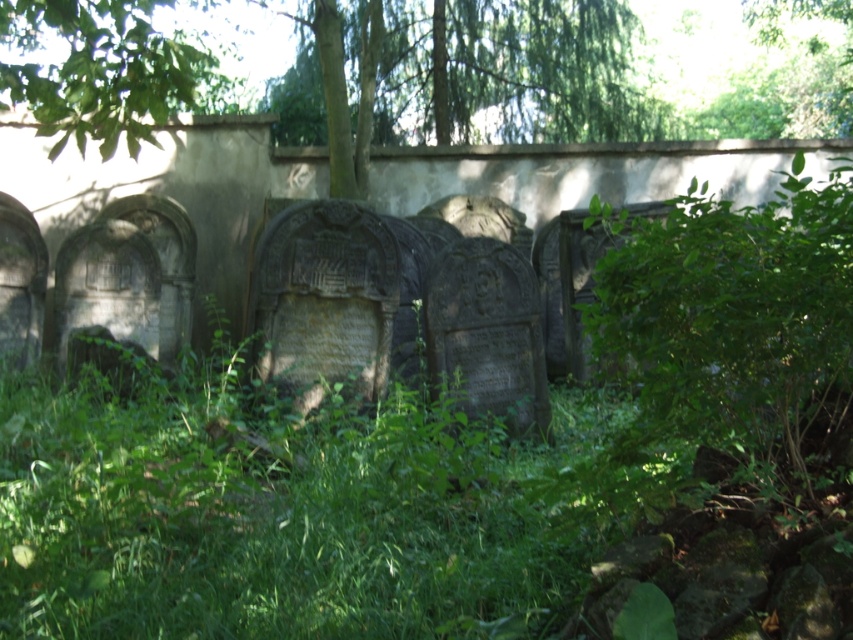
You are standing at the entrance of the cemetery and notice a green leafy tree at upper left. Can you determine its exact location in the image using coordinates?

The green leafy tree at upper left is located at point (103, 70), so its exact coordinates are 0.111 on the x axis and 0.123 on the y axis.

You are a visitor to the cemetery and want to take a photo of both the green leafy tree at upper left and the green leafy tree at upper right in the same frame. Considering their sizes, which tree should you position closer to the camera to ensure both are visible clearly?

To ensure both the green leafy tree at upper left and the green leafy tree at upper right are visible clearly in the same frame, you should position the green leafy tree at upper left closer to the camera. Since it is smaller in size compared to the green leafy tree at upper right, placing it nearer will help balance their apparent sizes in the photo.

You are a gardener planning to trim the green leafy tree at upper left and the green leafy tree at upper right. Which tree requires a longer ladder to reach its full height?

The green leafy tree at upper right requires a longer ladder because its width is greater than the green leafy tree at upper left, indicating it might be taller.